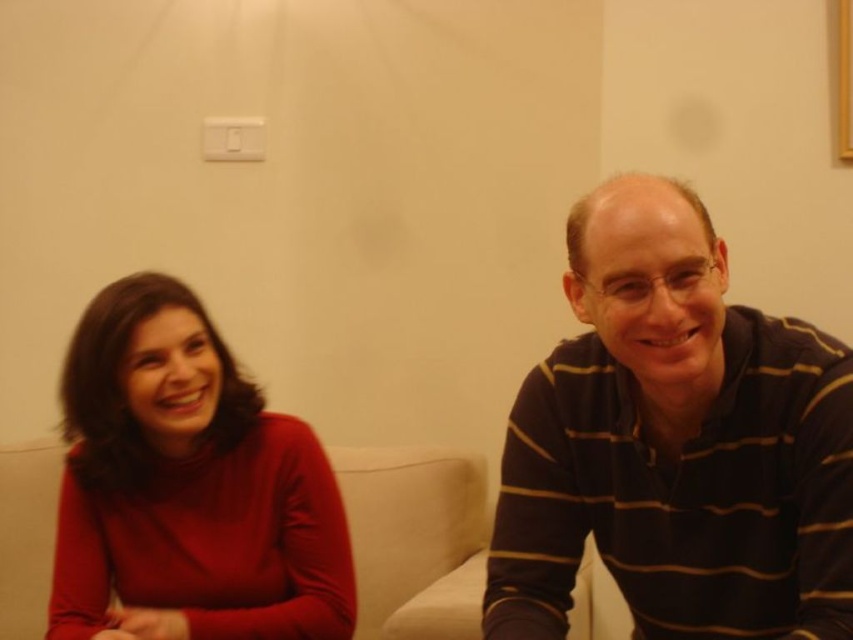
Can you confirm if black striped shirt at right is positioned above white fabric couch at center?

Correct, black striped shirt at right is located above white fabric couch at center.

Is black striped shirt at right taller than white fabric couch at center?

Indeed, black striped shirt at right has a greater height compared to white fabric couch at center.

This screenshot has width=853, height=640. Describe the element at coordinates (675, 444) in the screenshot. I see `black striped shirt at right` at that location.

Identify the location of black striped shirt at right. (675, 444).

Looking at this image, does matte red sweater at left appear on the left side of white fabric couch at center?

Yes, matte red sweater at left is to the left of white fabric couch at center.

Which is behind, point (112, 417) or point (419, 634)?

The point (419, 634) is more distant.

Locate an element on the screen. This screenshot has height=640, width=853. matte red sweater at left is located at coordinates (189, 484).

Find the location of a particular element. The height and width of the screenshot is (640, 853). black striped shirt at right is located at coordinates (675, 444).

Is point (836, 627) behind point (115, 484)?

No.

I want to click on black striped shirt at right, so click(x=675, y=444).